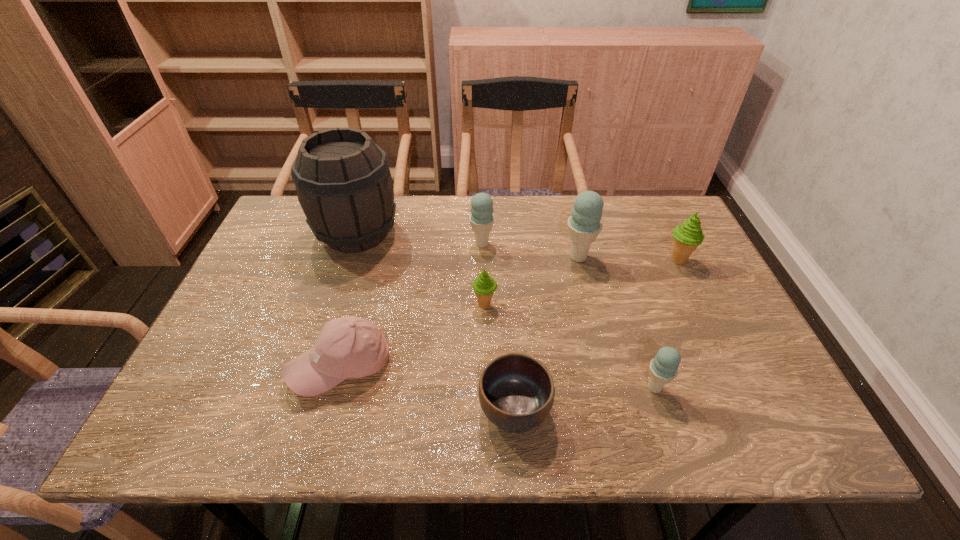
Where is `object that can be found as the seventh closest to the smallest blue ice cream`? Image resolution: width=960 pixels, height=540 pixels. object that can be found as the seventh closest to the smallest blue ice cream is located at coordinates (343, 182).

Find the location of a particular element. The image size is (960, 540). object that stands as the seventh closest to the leftmost blue ice cream is located at coordinates (663, 368).

Identify which icecream is the second closest to the baseball cap. Please provide its 2D coordinates. Your answer should be formatted as a tuple, i.e. [(x, y)], where the tuple contains the x and y coordinates of a point satisfying the conditions above.

[(481, 218)]

Where is `the fifth closest icecream to the bowl`? The image size is (960, 540). the fifth closest icecream to the bowl is located at coordinates [688, 236].

This screenshot has width=960, height=540. I want to click on blue ice cream that stands as the closest to the tallest icecream, so click(x=481, y=218).

I want to click on the closest blue ice cream to the bowl, so click(663, 368).

In order to click on free point that satisfies the following two spatial constraints: 1. on the front-facing side of the second object from right to left; 2. on the left side of the baseball cap in this screenshot , I will do `click(335, 388)`.

Locate an element on the screen. Image resolution: width=960 pixels, height=540 pixels. free space that satisfies the following two spatial constraints: 1. on the front-facing side of the baseball cap; 2. on the right side of the bowl is located at coordinates (329, 410).

You are a GUI agent. You are given a task and a screenshot of the screen. Output one action in this format:
    pyautogui.click(x=<x>, y=<y>)
    Task: Click on the vacant space that satisfies the following two spatial constraints: 1. on the front-facing side of the pink baseball cap; 2. on the left side of the nearest blue ice cream
    This screenshot has height=540, width=960.
    Given the screenshot: What is the action you would take?
    pyautogui.click(x=335, y=388)

You are a GUI agent. You are given a task and a screenshot of the screen. Output one action in this format:
    pyautogui.click(x=<x>, y=<y>)
    Task: Click on the vacant region that satisfies the following two spatial constraints: 1. on the front side of the bowl; 2. on the left side of the nearer green icecream
    The height and width of the screenshot is (540, 960).
    Given the screenshot: What is the action you would take?
    pyautogui.click(x=486, y=410)